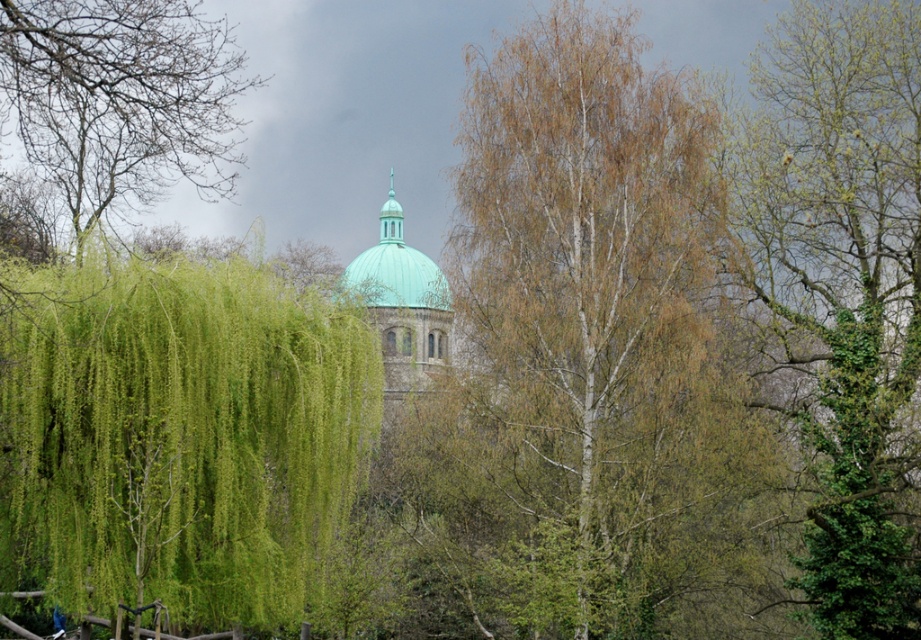
Question: Which point is farther from the camera taking this photo?

Choices:
 (A) (732, 625)
 (B) (197, 115)

Answer: (A)

Question: Can you confirm if smooth white bark tree at center is thinner than green leafy tree at left?

Choices:
 (A) no
 (B) yes

Answer: (A)

Question: Which point appears closest to the camera in this image?

Choices:
 (A) (130, 38)
 (B) (581, 388)

Answer: (A)

Question: In this image, where is smooth white bark tree at center located relative to green leafy tree at right?

Choices:
 (A) left
 (B) right

Answer: (A)

Question: Considering the real-world distances, which object is closest to the green leafy tree at left?

Choices:
 (A) green leafy tree at right
 (B) green matte dome at center
 (C) smooth white bark tree at center

Answer: (C)

Question: Where is green leafy willow at left located in relation to green leafy tree at left in the image?

Choices:
 (A) above
 (B) below

Answer: (B)